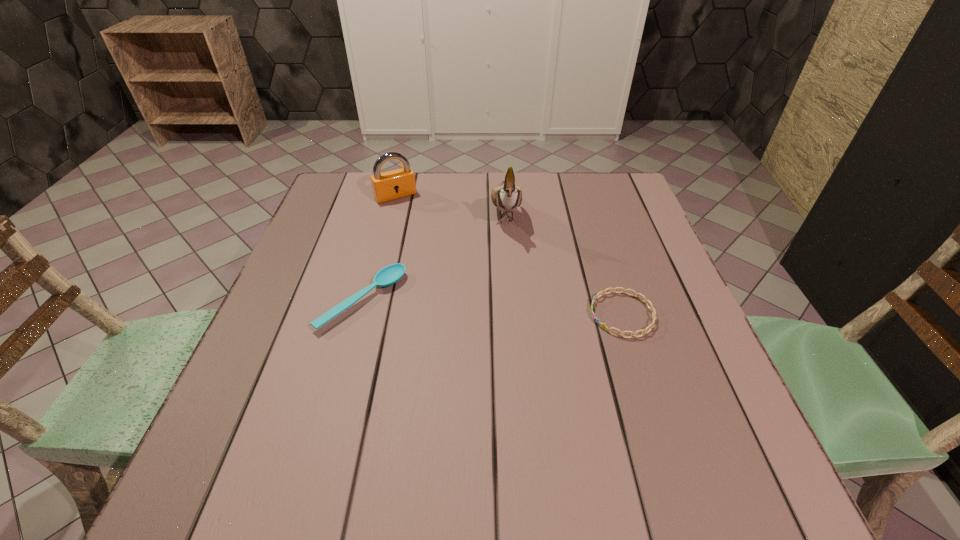
Identify the location of free spot that satisfies the following two spatial constraints: 1. on the front side of the bracelet; 2. on the surface of the spoon showing star-shaped elements. This screenshot has height=540, width=960. (359, 314).

Find the location of `free space that satisfies the following two spatial constraints: 1. on the front side of the tallest object; 2. on the surface of the rightmost object showing star-shaped elements`. free space that satisfies the following two spatial constraints: 1. on the front side of the tallest object; 2. on the surface of the rightmost object showing star-shaped elements is located at coordinates (514, 314).

Find the location of a particular element. free point that satisfies the following two spatial constraints: 1. on the front side of the bird; 2. on the surface of the rightmost object showing star-shaped elements is located at coordinates (514, 314).